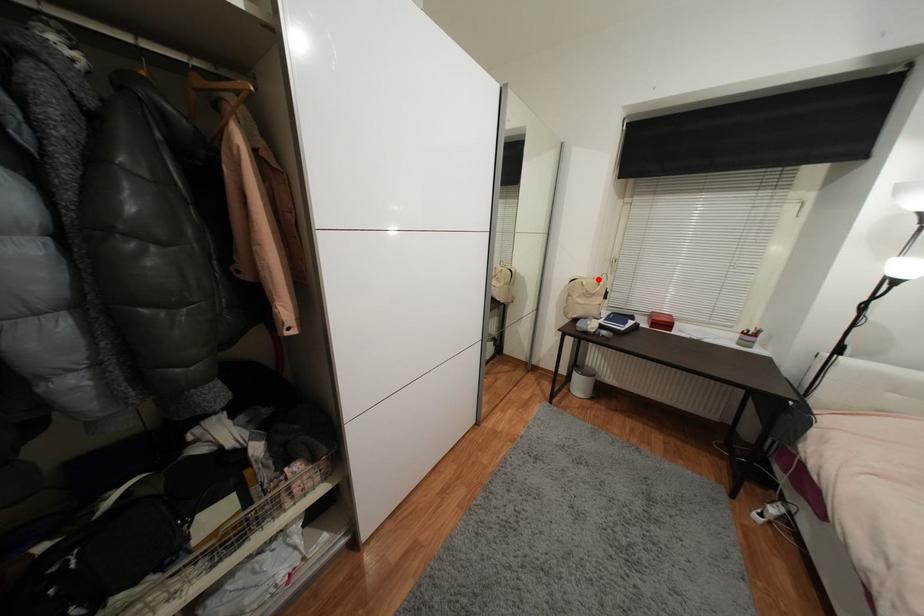
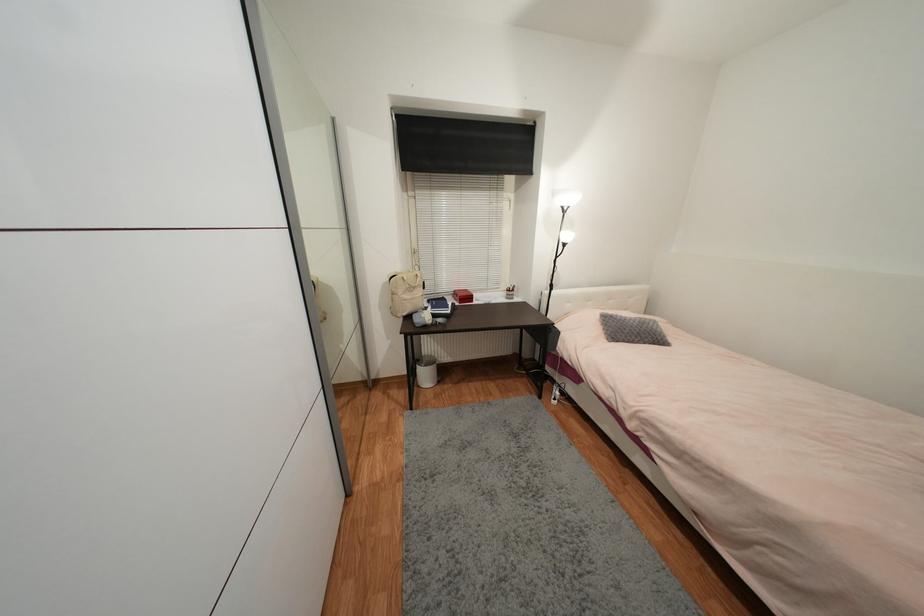
In the second image, find the point that corresponds to the highlighted location in the first image.

(412, 273)